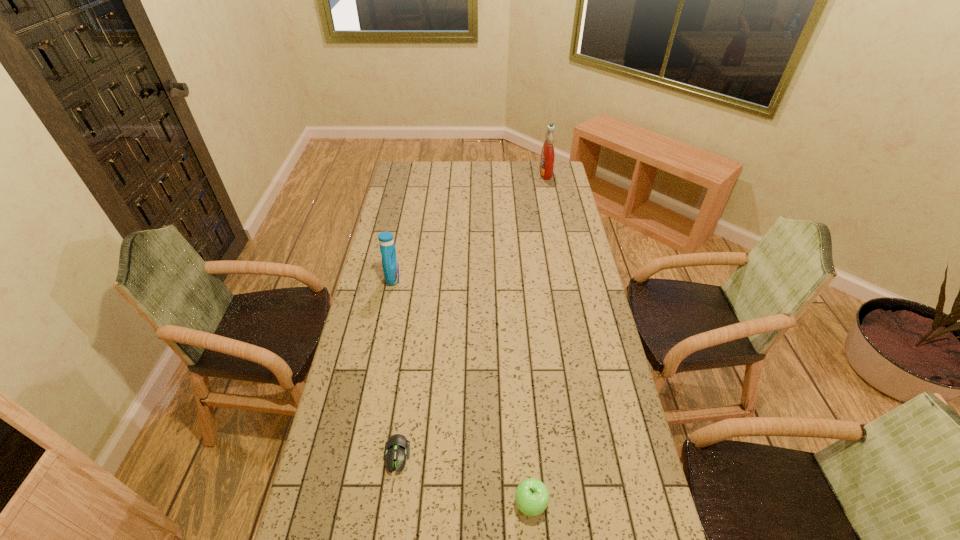
This screenshot has width=960, height=540. In the image, there is a desktop. What are the coordinates of `free space at the right edge` in the screenshot? It's located at (547, 248).

Where is `vacant area between the apple and the third object from right to left`? Image resolution: width=960 pixels, height=540 pixels. vacant area between the apple and the third object from right to left is located at coordinates (464, 480).

This screenshot has width=960, height=540. Identify the location of empty space that is in between the third object from right to left and the third shortest object. (395, 367).

Find the location of a particular element. The image size is (960, 540). vacant area that lies between the leftmost object and the third farthest object is located at coordinates (395, 367).

The width and height of the screenshot is (960, 540). In order to click on vacant point located between the third tallest object and the third farthest object in this screenshot , I will do `click(464, 480)`.

The image size is (960, 540). Find the location of `free point between the leftmost object and the apple`. free point between the leftmost object and the apple is located at coordinates (462, 391).

The image size is (960, 540). In order to click on unoccupied area between the farther detergent and the apple in this screenshot , I will do `click(539, 338)`.

Locate an element on the screen. Image resolution: width=960 pixels, height=540 pixels. vacant space that's between the nearer detergent and the shortest object is located at coordinates (395, 367).

Locate an element on the screen. empty space that is in between the taller detergent and the shortest object is located at coordinates (471, 314).

Identify the location of free spot between the tallest object and the apple. This screenshot has height=540, width=960. (539, 338).